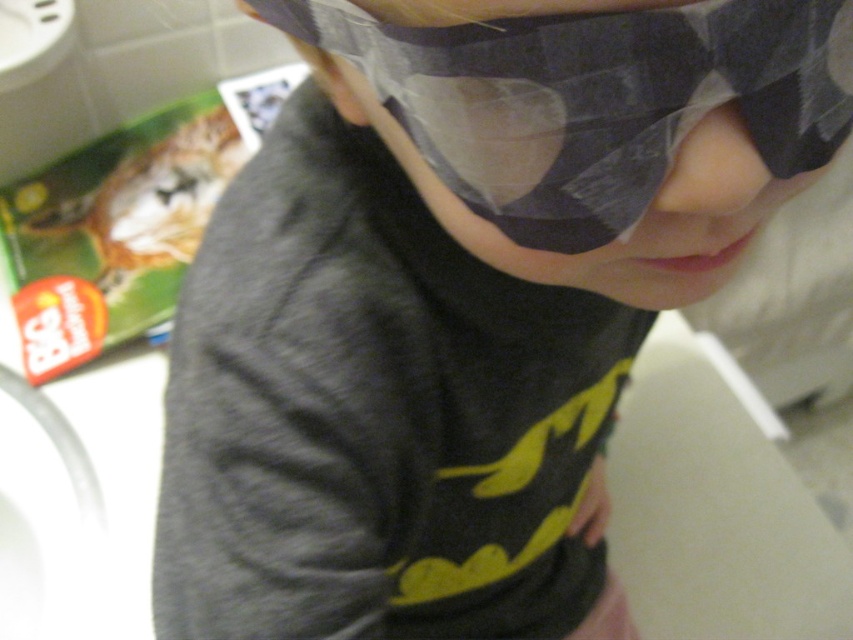
Can you confirm if matte black eye mask at center is shorter than pink smooth skin at center?

In fact, matte black eye mask at center may be taller than pink smooth skin at center.

Between point (563, 211) and point (729, 182), which one is positioned behind?

Positioned behind is point (563, 211).

Which is in front, point (442, 144) or point (743, 188)?

Point (743, 188) is in front.

You are a GUI agent. You are given a task and a screenshot of the screen. Output one action in this format:
    pyautogui.click(x=<x>, y=<y>)
    Task: Click on the matte black eye mask at center
    This screenshot has width=853, height=640.
    Given the screenshot: What is the action you would take?
    pyautogui.click(x=592, y=120)